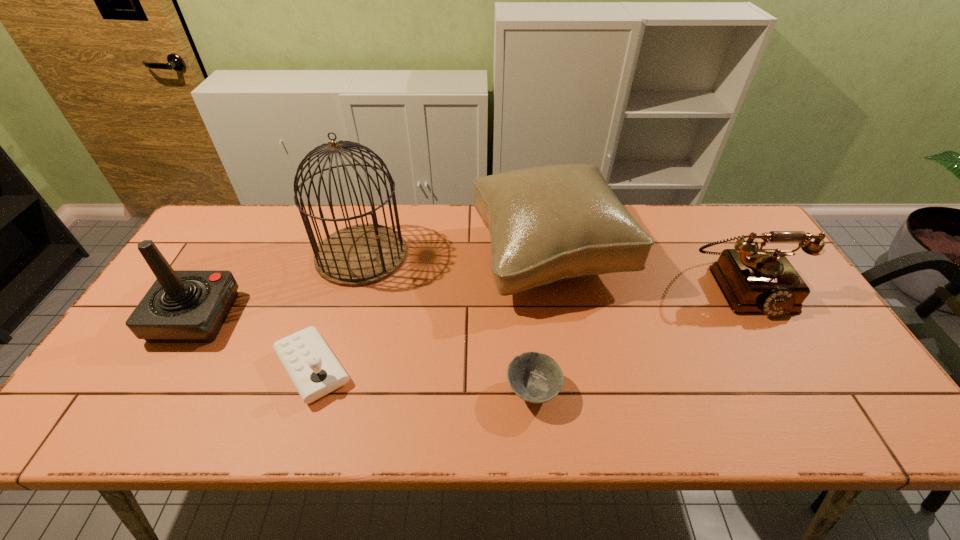
The image size is (960, 540). I want to click on free spot between the cushion and the telephone, so click(x=647, y=271).

Where is `free space between the third shortest object and the taller joystick`? The width and height of the screenshot is (960, 540). free space between the third shortest object and the taller joystick is located at coordinates (469, 302).

The image size is (960, 540). I want to click on empty space that is in between the fifth tallest object and the bowl, so click(422, 380).

Locate an element on the screen. The height and width of the screenshot is (540, 960). vacant space that is in between the birdcage and the shortest object is located at coordinates (447, 323).

I want to click on free area in between the shortest object and the fifth tallest object, so click(422, 380).

Identify the location of unoccupied area between the tallest object and the shortest object. (447, 323).

You are a GUI agent. You are given a task and a screenshot of the screen. Output one action in this format:
    pyautogui.click(x=<x>, y=<y>)
    Task: Click on the vacant area that lies between the shortest object and the taller joystick
    
    Given the screenshot: What is the action you would take?
    pyautogui.click(x=364, y=354)

Identify the location of empty space that is in between the cushion and the taller joystick. (372, 286).

You are a GUI agent. You are given a task and a screenshot of the screen. Output one action in this format:
    pyautogui.click(x=<x>, y=<y>)
    Task: Click on the object that ranks as the closest to the third shortest object
    The width and height of the screenshot is (960, 540).
    Given the screenshot: What is the action you would take?
    pyautogui.click(x=547, y=223)

Locate which object is the fourth closest to the tallest object. Please provide its 2D coordinates. Your answer should be formatted as a tuple, i.e. [(x, y)], where the tuple contains the x and y coordinates of a point satisfying the conditions above.

[(536, 378)]